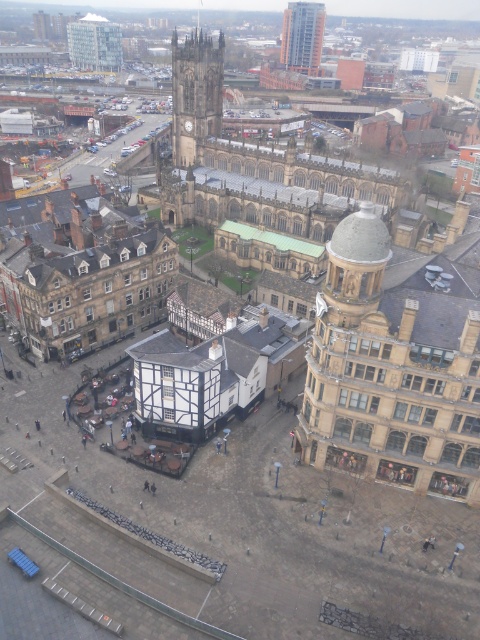
Question: Which of the following is the closest to the observer?

Choices:
 (A) white glass tower at upper left
 (B) beige stone tower at center right

Answer: (B)

Question: Which object is closer to the camera taking this photo?

Choices:
 (A) white glass tower at upper left
 (B) beige stone tower at center right
 (C) dark gray stone clock tower at center

Answer: (B)

Question: Which of the following is the closest to the observer?

Choices:
 (A) glassy steel skyscraper at upper center
 (B) dark gray stone clock tower at center

Answer: (B)

Question: In this image, where is dark gray stone clock tower at center located relative to glassy steel skyscraper at upper center?

Choices:
 (A) above
 (B) below

Answer: (B)

Question: Can you confirm if beige stone tower at center right is thinner than glassy steel skyscraper at upper center?

Choices:
 (A) no
 (B) yes

Answer: (B)

Question: Is dark gray stone clock tower at center to the left of white glass tower at upper left from the viewer's perspective?

Choices:
 (A) yes
 (B) no

Answer: (B)